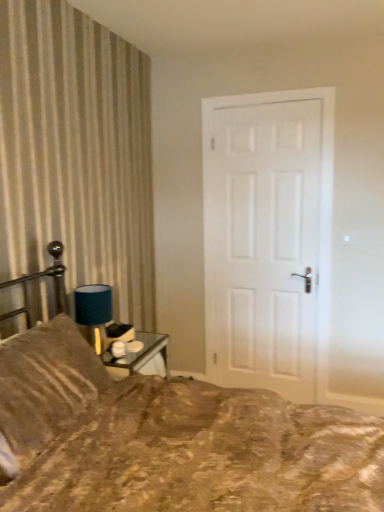
Identify the location of blue fabric lampshade at upper left. (93, 313).

Image resolution: width=384 pixels, height=512 pixels. I want to click on blue fabric lampshade at upper left, so click(x=93, y=313).

How many degrees apart are the facing directions of white matte door at center and blue fabric lampshade at upper left?

The facing directions of white matte door at center and blue fabric lampshade at upper left are 89.7 degrees apart.

From the image's perspective, relative to blue fabric lampshade at upper left, is white matte door at center above or below?

From the image's perspective, white matte door at center appears above blue fabric lampshade at upper left.

Considering the sizes of white matte door at center and blue fabric lampshade at upper left in the image, is white matte door at center taller or shorter than blue fabric lampshade at upper left?

Clearly, white matte door at center is taller compared to blue fabric lampshade at upper left.

From the picture: Considering the relative positions of white matte door at center and blue fabric lampshade at upper left in the image provided, is white matte door at center to the left or to the right of blue fabric lampshade at upper left?

Based on their positions, white matte door at center is located to the right of blue fabric lampshade at upper left.

From the image's perspective, who appears lower, brown textured fabric bed at lower left or brown textured pillow at left?

From the image's view, brown textured fabric bed at lower left is below.

Between brown textured fabric bed at lower left and brown textured pillow at left, which one has larger width?

With larger width is brown textured fabric bed at lower left.

How different are the orientations of brown textured fabric bed at lower left and brown textured pillow at left in degrees?

The angular difference between brown textured fabric bed at lower left and brown textured pillow at left is 0.0011 degrees.

Does point (296, 498) come in front of point (66, 320)?

Yes, point (296, 498) is in front of point (66, 320).

Is blue fabric lampshade at upper left not near white matte door at center?

A: Absolutely, blue fabric lampshade at upper left is distant from white matte door at center.

From the image's perspective, is blue fabric lampshade at upper left located beneath white matte door at center?

Yes.

Looking at the image, does blue fabric lampshade at upper left seem bigger or smaller compared to white matte door at center?

Clearly, blue fabric lampshade at upper left is smaller in size than white matte door at center.

The image size is (384, 512). Find the location of `door above the blue fabric lampshade at upper left (from a real-world perspective)`. door above the blue fabric lampshade at upper left (from a real-world perspective) is located at coordinates (265, 236).

Relative to blue fabric lampshade at upper left, is brown textured pillow at left in front or behind?

Visually, brown textured pillow at left is located in front of blue fabric lampshade at upper left.

Can you confirm if brown textured pillow at left is smaller than blue fabric lampshade at upper left?

No.

Is brown textured pillow at left next to blue fabric lampshade at upper left and touching it?

No, brown textured pillow at left is not beside blue fabric lampshade at upper left.

Locate an element on the screen. table lamp positioned vertically above the brown textured pillow at left (from a real-world perspective) is located at coordinates (93, 313).

Is white matte door at center surrounded by brown textured fabric bed at lower left?

No, white matte door at center is located outside of brown textured fabric bed at lower left.

From a real-world perspective, which object stands above the other?

From a 3D spatial view, white matte door at center is above.

Is the surface of brown textured fabric bed at lower left in direct contact with white matte door at center?

brown textured fabric bed at lower left and white matte door at center are not in contact.

How distant is brown textured fabric bed at lower left from white matte door at center?

brown textured fabric bed at lower left is 1.51 meters from white matte door at center.

How much distance is there between brown textured pillow at left and white matte door at center?

brown textured pillow at left is 5.21 feet away from white matte door at center.

Looking at this image, is brown textured pillow at left smaller than white matte door at center?

Yes, brown textured pillow at left is smaller than white matte door at center.

Is brown textured pillow at left positioned behind white matte door at center?

That is False.

Are brown textured pillow at left and white matte door at center located far from each other?

Yes, brown textured pillow at left and white matte door at center are quite far apart.

Can you tell me how much blue fabric lampshade at upper left and brown textured pillow at left differ in facing direction?

They differ by 0.00186 degrees in their facing directions.

Which of these two, blue fabric lampshade at upper left or brown textured pillow at left, stands taller?

brown textured pillow at left.

From a real-world perspective, is blue fabric lampshade at upper left positioned above or below brown textured pillow at left?

From a real-world perspective, blue fabric lampshade at upper left is physically above brown textured pillow at left.

I want to click on door behind the blue fabric lampshade at upper left, so click(265, 236).

Identify the location of pillow above the brown textured fabric bed at lower left (from the image's perspective). (46, 383).

Estimate the real-world distances between objects in this image. Which object is closer to brown textured pillow at left, brown textured fabric bed at lower left or white matte door at center?

Among the two, brown textured fabric bed at lower left is located nearer to brown textured pillow at left.

From the image, which object appears to be nearer to brown textured pillow at left, brown textured fabric bed at lower left or blue fabric lampshade at upper left?

brown textured fabric bed at lower left is positioned closer to the anchor brown textured pillow at left.

Consider the image. Estimate the real-world distances between objects in this image. Which object is closer to white matte door at center, brown textured fabric bed at lower left or brown textured pillow at left?

brown textured fabric bed at lower left.

From the image, which object appears to be nearer to white matte door at center, brown textured pillow at left or brown textured fabric bed at lower left?

The object closer to white matte door at center is brown textured fabric bed at lower left.

Based on their spatial positions, is blue fabric lampshade at upper left or white matte door at center closer to brown textured pillow at left?

The object closer to brown textured pillow at left is blue fabric lampshade at upper left.

Based on their spatial positions, is blue fabric lampshade at upper left or brown textured fabric bed at lower left closer to white matte door at center?

Among the two, blue fabric lampshade at upper left is located nearer to white matte door at center.

Based on their spatial positions, is white matte door at center or blue fabric lampshade at upper left closer to brown textured fabric bed at lower left?

blue fabric lampshade at upper left.

Which object lies further to the anchor point blue fabric lampshade at upper left, brown textured fabric bed at lower left or white matte door at center?

white matte door at center is further to blue fabric lampshade at upper left.

At what (x,y) coordinates should I click in order to perform the action: click on pillow between brown textured fabric bed at lower left and white matte door at center from front to back. Please return your answer as a coordinate pair (x, y). The width and height of the screenshot is (384, 512). Looking at the image, I should click on (46, 383).

Identify the location of table lamp between brown textured pillow at left and white matte door at center along the z-axis. The image size is (384, 512). (93, 313).

Locate an element on the screen. This screenshot has width=384, height=512. table lamp located between brown textured fabric bed at lower left and white matte door at center in the depth direction is located at coordinates (93, 313).

Locate an element on the screen. pillow between brown textured fabric bed at lower left and blue fabric lampshade at upper left from front to back is located at coordinates (46, 383).